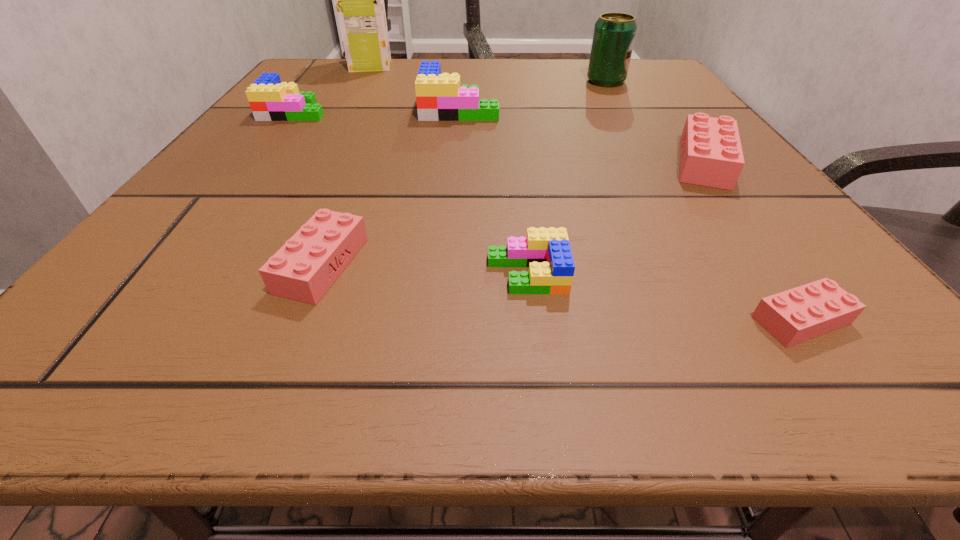
You are a GUI agent. You are given a task and a screenshot of the screen. Output one action in this format:
    pyautogui.click(x=<x>, y=<y>)
    Task: Click on the object located in the far right corner section of the desktop
    This screenshot has height=540, width=960.
    Given the screenshot: What is the action you would take?
    pyautogui.click(x=614, y=34)

The width and height of the screenshot is (960, 540). In order to click on object that is at the near right corner in this screenshot , I will do `click(802, 313)`.

Locate an element on the screen. The width and height of the screenshot is (960, 540). vacant space at the far edge of the desktop is located at coordinates (574, 85).

Where is `free space at the near edge`? The width and height of the screenshot is (960, 540). free space at the near edge is located at coordinates [711, 353].

I want to click on free space at the left edge of the desktop, so click(x=260, y=183).

At what (x,y) coordinates should I click in order to perform the action: click on blank space at the right edge. Please return your answer as a coordinate pair (x, y). The height and width of the screenshot is (540, 960). Looking at the image, I should click on (680, 227).

Identify the location of vacant space at the near right corner of the desktop. The width and height of the screenshot is (960, 540). (908, 364).

Locate an element on the screen. This screenshot has width=960, height=540. blank region between the second biggest pink Lego and the beer can is located at coordinates (464, 173).

At what (x,y) coordinates should I click in order to perform the action: click on free spot between the green beer can and the shortest object. Please return your answer as a coordinate pair (x, y). This screenshot has width=960, height=540. Looking at the image, I should click on (704, 201).

Identify the location of free spot between the fourth nearest object and the leftmost green Lego. (499, 137).